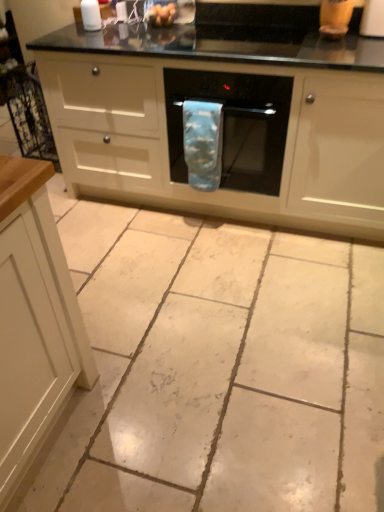
Question: Is black glass oven at center at the left side of blue fabric oven mitt at center?

Choices:
 (A) no
 (B) yes

Answer: (B)

Question: From the image's perspective, does black glass oven at center appear higher than blue fabric oven mitt at center?

Choices:
 (A) yes
 (B) no

Answer: (B)

Question: Would you say black glass oven at center contains blue fabric oven mitt at center?

Choices:
 (A) no
 (B) yes

Answer: (B)

Question: From a real-world perspective, is black glass oven at center on top of blue fabric oven mitt at center?

Choices:
 (A) no
 (B) yes

Answer: (A)

Question: Is black glass oven at center to the right of blue fabric oven mitt at center from the viewer's perspective?

Choices:
 (A) no
 (B) yes

Answer: (A)

Question: Considering the positions of white tile floor at center and blue fabric towel at center in the image, is white tile floor at center taller or shorter than blue fabric towel at center?

Choices:
 (A) tall
 (B) short

Answer: (B)

Question: Considering the positions of point (117, 216) and point (213, 101), is point (117, 216) closer or farther from the camera than point (213, 101)?

Choices:
 (A) closer
 (B) farther

Answer: (B)

Question: Based on their positions, is white tile floor at center located to the left or right of blue fabric towel at center?

Choices:
 (A) right
 (B) left

Answer: (B)

Question: From the image's perspective, is white tile floor at center positioned above or below blue fabric towel at center?

Choices:
 (A) below
 (B) above

Answer: (A)

Question: Looking at the image, does blue fabric towel at center seem bigger or smaller compared to white glossy salt shaker at upper left?

Choices:
 (A) big
 (B) small

Answer: (A)

Question: From their relative heights in the image, would you say blue fabric towel at center is taller or shorter than white glossy salt shaker at upper left?

Choices:
 (A) tall
 (B) short

Answer: (A)

Question: Is point (213, 121) positioned closer to the camera than point (97, 20)?

Choices:
 (A) closer
 (B) farther

Answer: (A)

Question: In terms of width, does blue fabric towel at center look wider or thinner when compared to white glossy salt shaker at upper left?

Choices:
 (A) thin
 (B) wide

Answer: (B)

Question: From a real-world perspective, is blue fabric oven mitt at center physically located above or below white glossy salt shaker at upper left?

Choices:
 (A) above
 (B) below

Answer: (B)

Question: Based on their sizes in the image, would you say blue fabric oven mitt at center is bigger or smaller than white glossy salt shaker at upper left?

Choices:
 (A) small
 (B) big

Answer: (B)